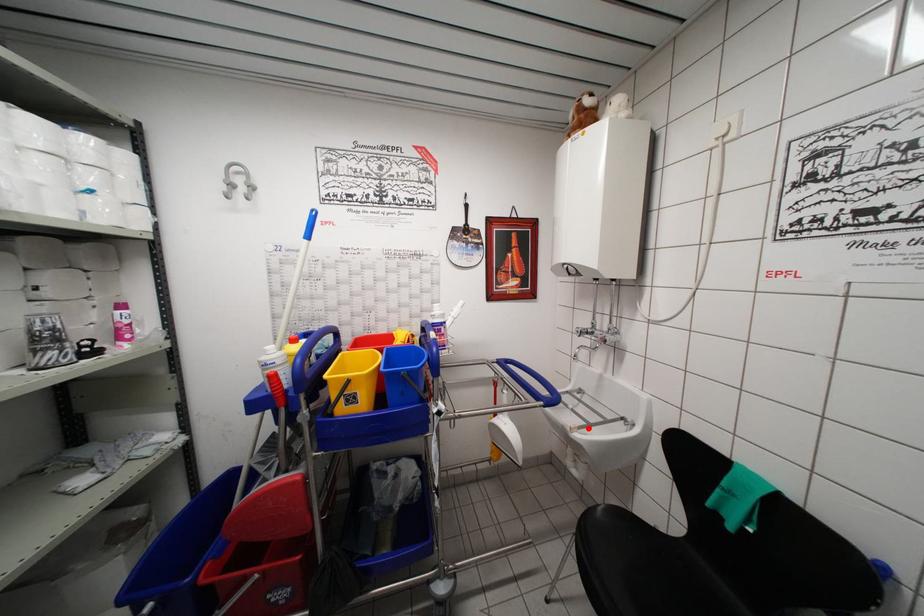
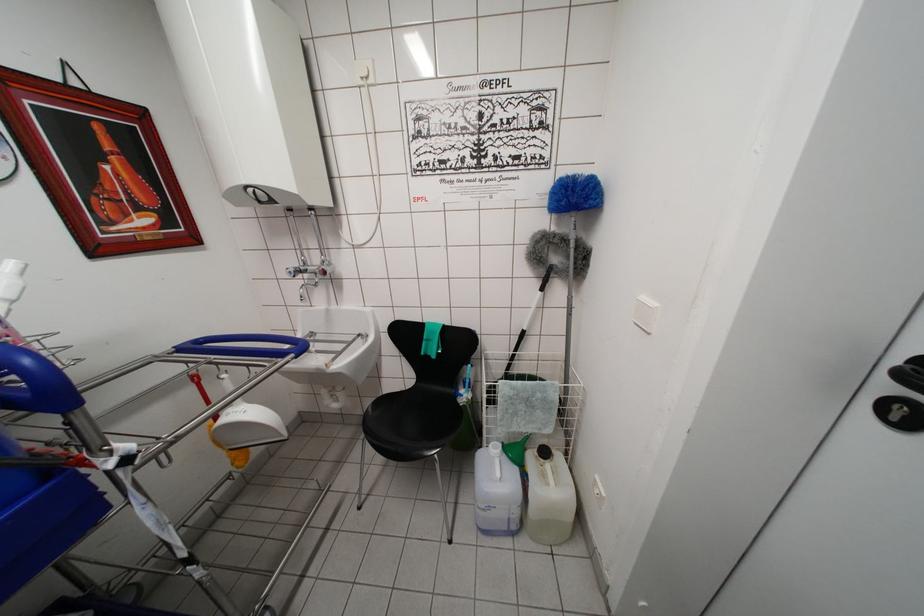
Question: I am providing you with two images of the same scene from different viewpoints. Image1 has a red point marked. In image2, the corresponding 3D location appears at what relative position? Reply with the corresponding letter.

Choices:
 (A) Closer
 (B) Farther

Answer: (A)